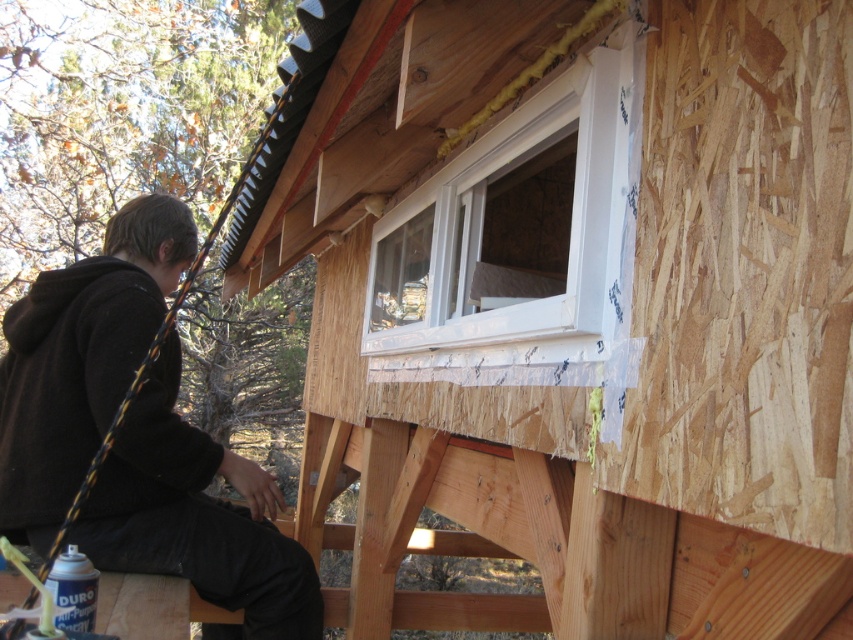
Is black hoodie at left positioned behind white plastic window at upper center?

Yes, black hoodie at left is further from the viewer.

Is black hoodie at left thinner than white plastic window at upper center?

Yes, black hoodie at left is thinner than white plastic window at upper center.

This screenshot has height=640, width=853. Identify the location of black hoodie at left. (80, 358).

In order to click on black hoodie at left in this screenshot , I will do `click(80, 358)`.